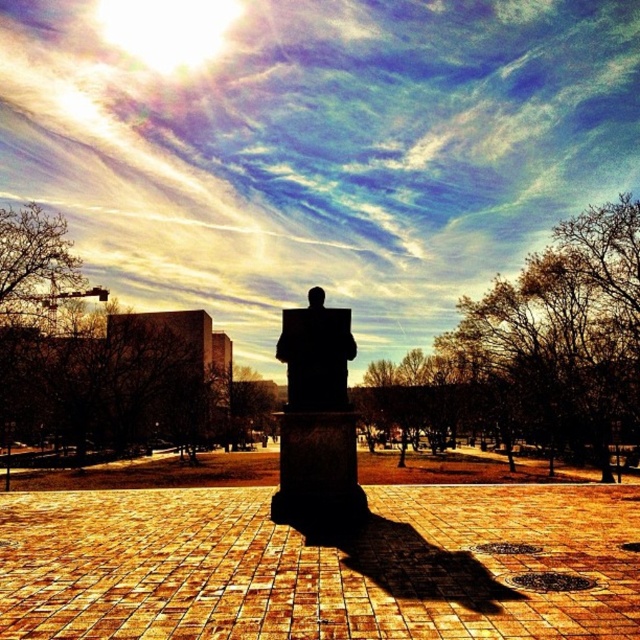
From the picture: You are an artist planning to paint this scene. You need to ensure the silhouette stone statue at center is smaller in width than the black stone statue at center. Does the current arrangement allow this?

Yes, the silhouette stone statue at center has a smaller width than the black stone statue at center according to the description.

You are an artist planning to paint the scene. You have two canvases, one smaller and one larger. Which canvas should you choose for the silhouette stone statue at center and which for the black stone statue at center?

The silhouette stone statue at center occupies less space than the black stone statue at center, so the smaller canvas is suitable for the silhouette stone statue at center and the larger canvas for the black stone statue at center.

You are an artist setting up an easel to paint the scene. You want to position your easel so that both the silhouette stone statue at center and the black stone statue at center are visible in your painting. Given their positions, where should you place your easel relative to the statues?

The silhouette stone statue at center is to the left of the black stone statue at center, so placing the easel to the right of both statues would allow both to be visible in the painting.